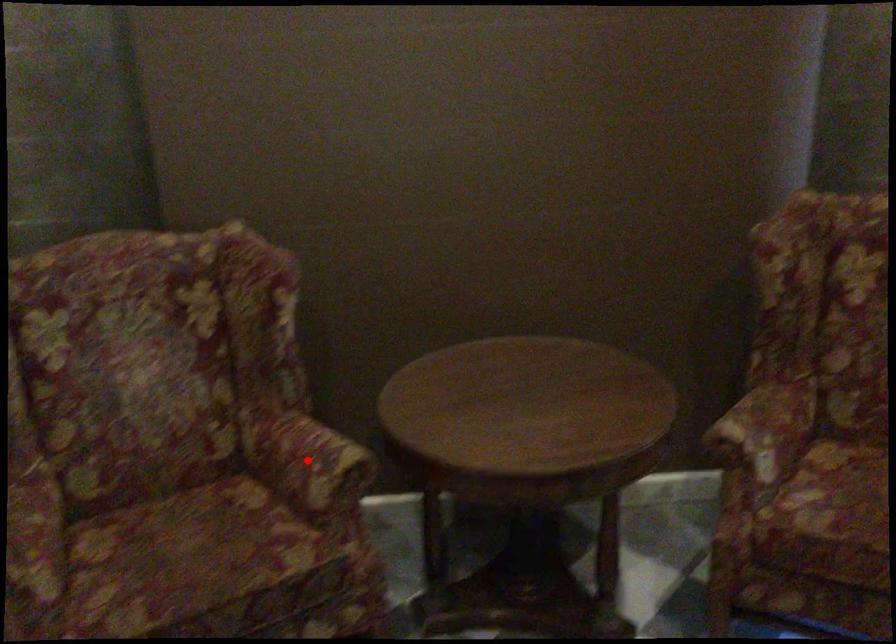
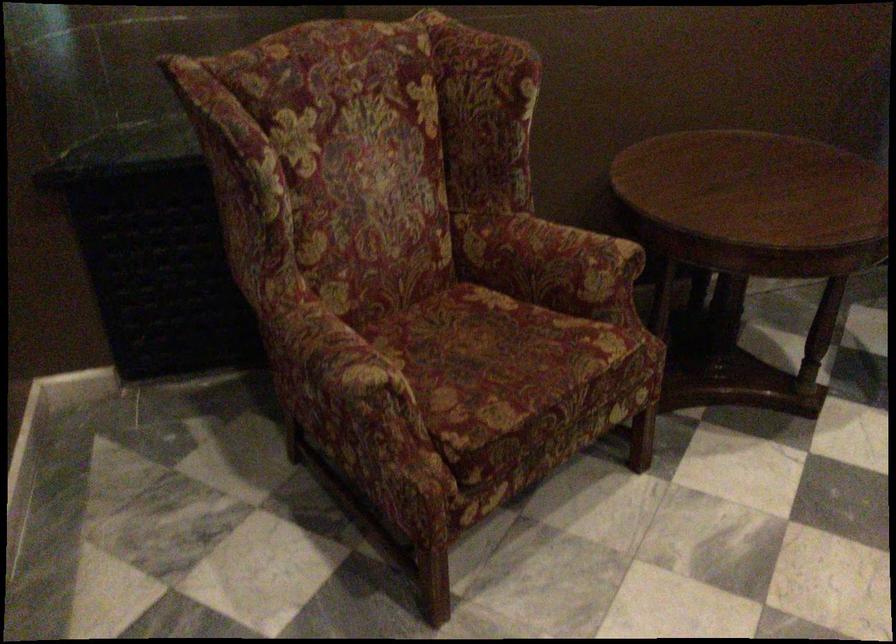
Locate, in the second image, the point that corresponds to the highlighted location in the first image.

(572, 256)